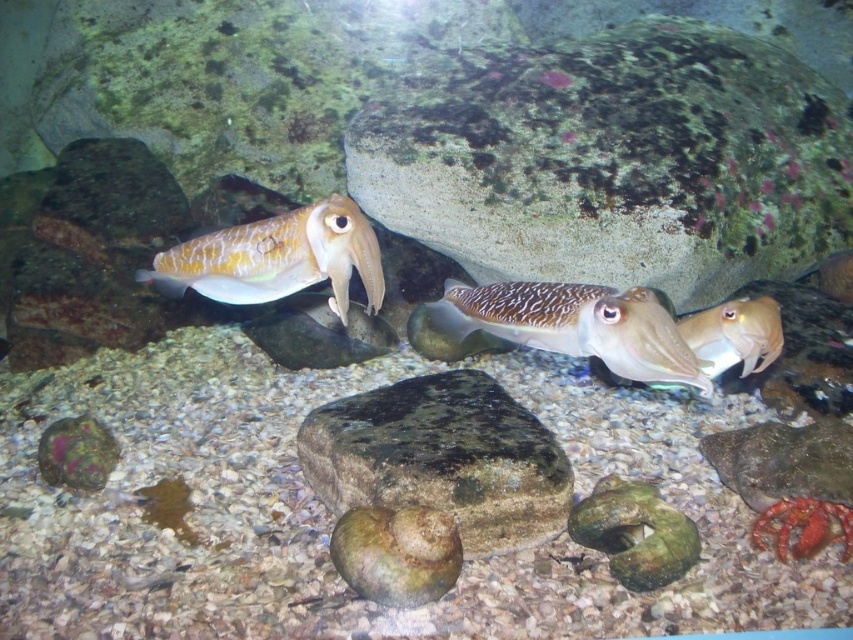
You are a marine biologist studying cuttlefish behavior. You observe two cuttlefish labeled as shiny brown squid at center and smooth brown squid at center. You need to place a 60 cm measuring tape between them to measure their separation. Will the measuring tape be long enough to reach both ends?

The distance between the shiny brown squid at center and the smooth brown squid at center is 59.02 centimeters. Since the measuring tape is 60 cm long, it will be long enough to reach both ends.

You are a marine biologist observing underwater. You have a 1.5 meter long measuring tape. If you extend it from your position to the shiny brown squid at center, will the tape be long enough to reach it?

The distance between you and the shiny brown squid at center is 1.22 meters. Since your measuring tape is 1.5 meters long, which is longer than the distance, the tape will be sufficient to reach the squid.

You are a marine biologist observing an underwater scene with a smooth brown squid at center. Your equipment measures distances from the viewer. If the safe handling distance for the squid is 4 feet, is the squid within a safe distance according to your measurements?

The smooth brown squid at center is 3.87 feet from the viewer, which is within the safe handling distance of 4 feet.